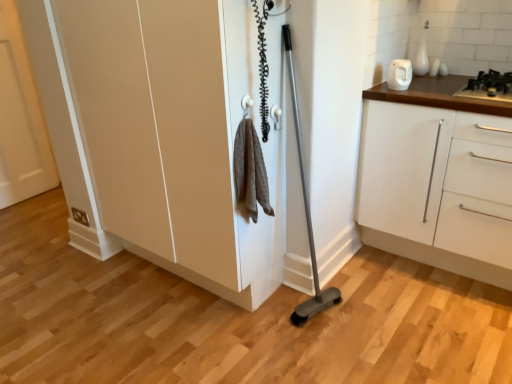
In order to click on free space in front of matte white cupboard at center in this screenshot , I will do `click(173, 341)`.